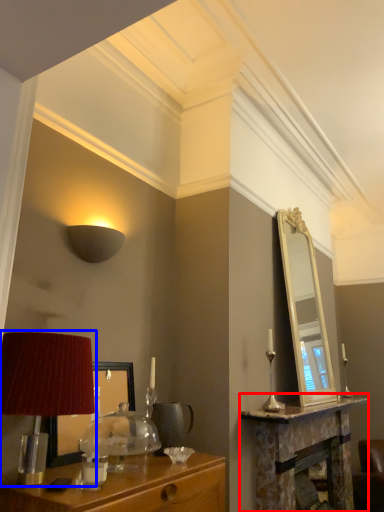
Question: Among these objects, which one is nearest to the camera, table (highlighted by a red box) or table lamp (highlighted by a blue box)?

Choices:
 (A) table
 (B) table lamp

Answer: (B)